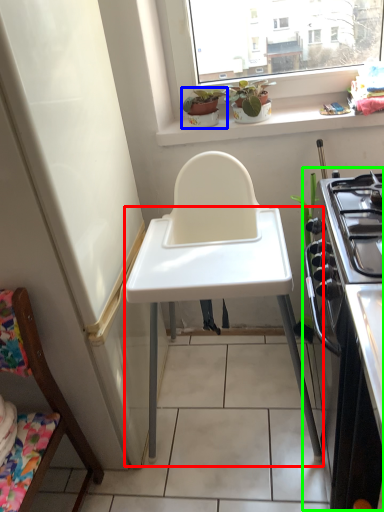
Question: Estimate the real-world distances between objects in this image. Which object is farther from table (highlighted by a red box), houseplant (highlighted by a blue box) or appliance (highlighted by a green box)?

Choices:
 (A) houseplant
 (B) appliance

Answer: (A)